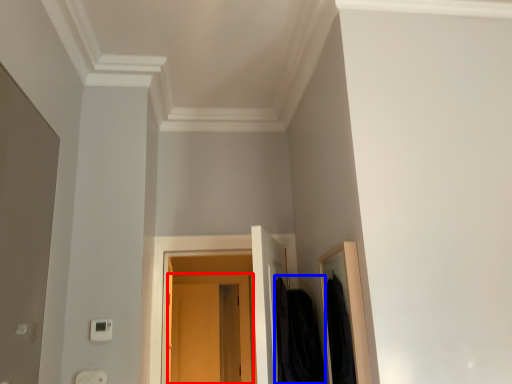
Question: Which object appears closest to the camera in this image, door (highlighted by a red box) or clothing (highlighted by a blue box)?

Choices:
 (A) door
 (B) clothing

Answer: (B)